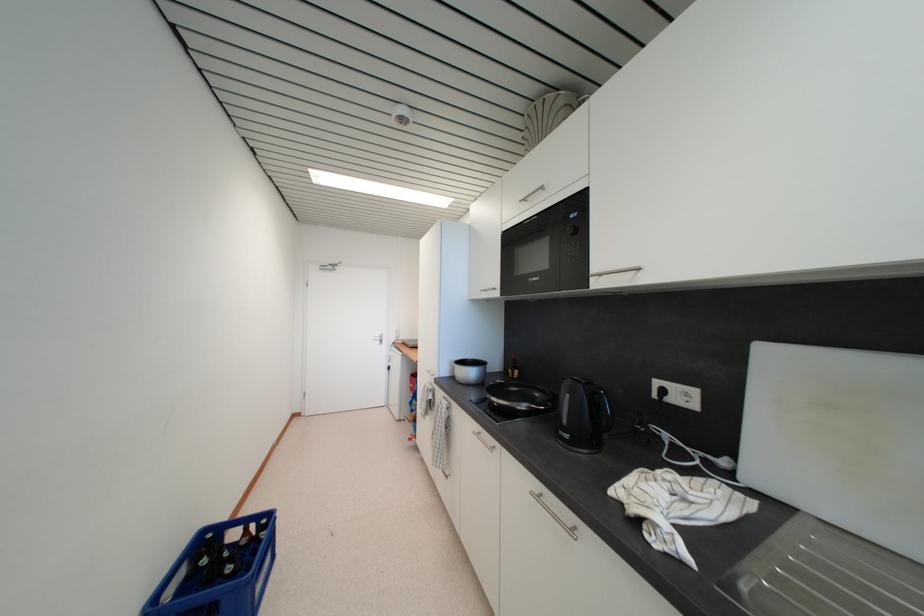
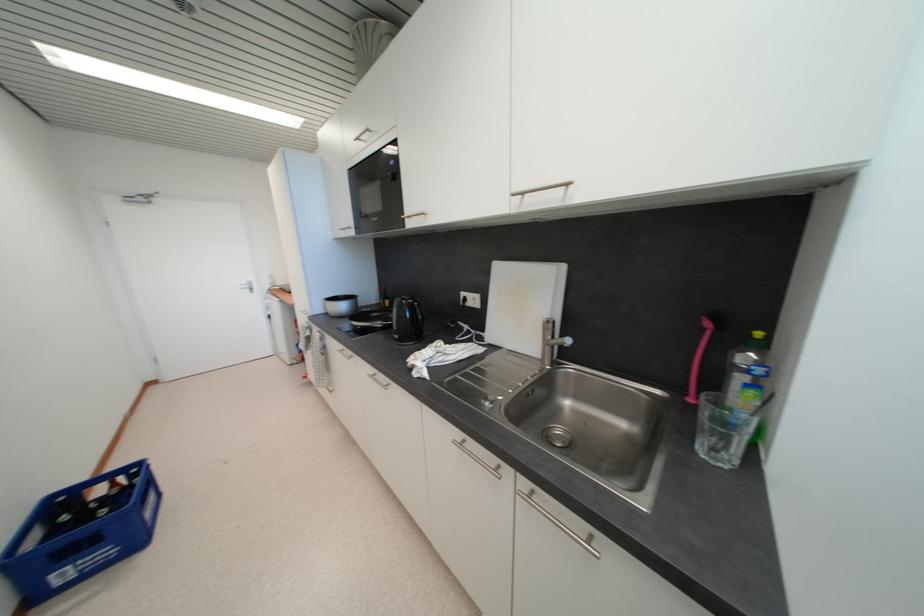
Find the pixel in the second image that matches [521,370] in the first image.

(392, 301)